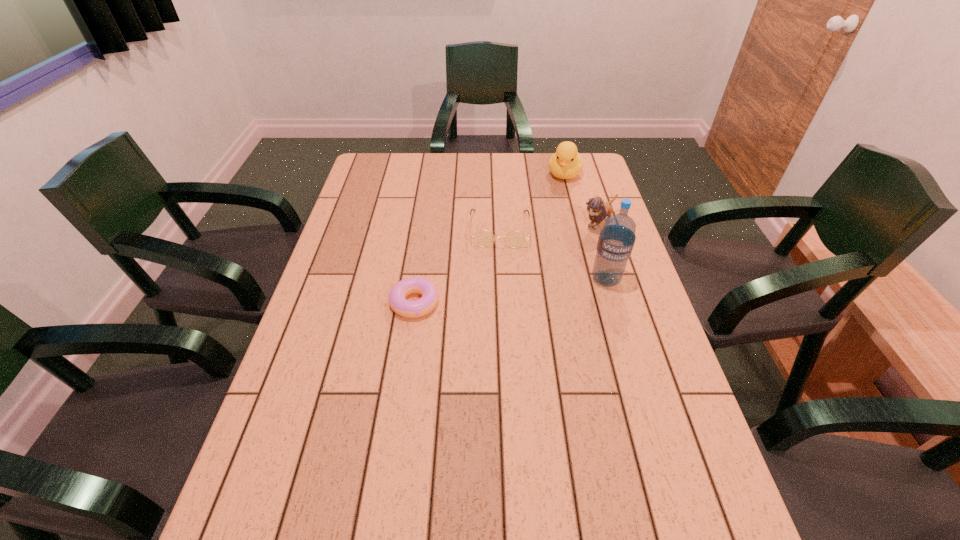
Where is `free space that satisfies the following two spatial constraints: 1. on the back side of the kitten; 2. on the right side of the spectacles`? The height and width of the screenshot is (540, 960). free space that satisfies the following two spatial constraints: 1. on the back side of the kitten; 2. on the right side of the spectacles is located at coordinates (499, 223).